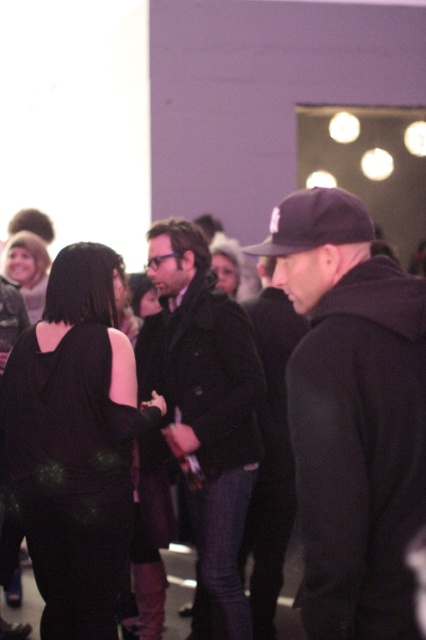
Describe the element at coordinates (204, 410) in the screenshot. I see `dark wool coat at center` at that location.

Who is more distant from viewer, [186,227] or [17,236]?

Point [17,236]

You are a GUI agent. You are given a task and a screenshot of the screen. Output one action in this format:
    pyautogui.click(x=<x>, y=<y>)
    Task: Click on the dark wool coat at center
    
    Given the screenshot: What is the action you would take?
    pyautogui.click(x=204, y=410)

Is black matte dress at center smaller than dark wool coat at center?

Correct, black matte dress at center occupies less space than dark wool coat at center.

Can you confirm if black matte dress at center is bigger than dark wool coat at center?

No, black matte dress at center is not bigger than dark wool coat at center.

Which is behind, point (120, 349) or point (149, 333)?

Point (149, 333)

The image size is (426, 640). I want to click on black matte dress at center, so click(74, 444).

Between point (48, 561) and point (351, 196), which one is positioned in front?

Point (351, 196)

Does black matte dress at center appear over black fabric baseball cap at center?

Incorrect, black matte dress at center is not positioned above black fabric baseball cap at center.

Locate an element on the screen. The height and width of the screenshot is (640, 426). black matte dress at center is located at coordinates (74, 444).